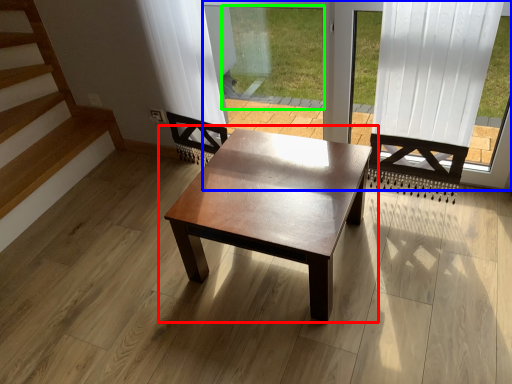
Question: Which object is the closest to the coffee table (highlighted by a red box)? Choose among these: window frame (highlighted by a blue box) or window screen (highlighted by a green box).

Choices:
 (A) window frame
 (B) window screen

Answer: (A)